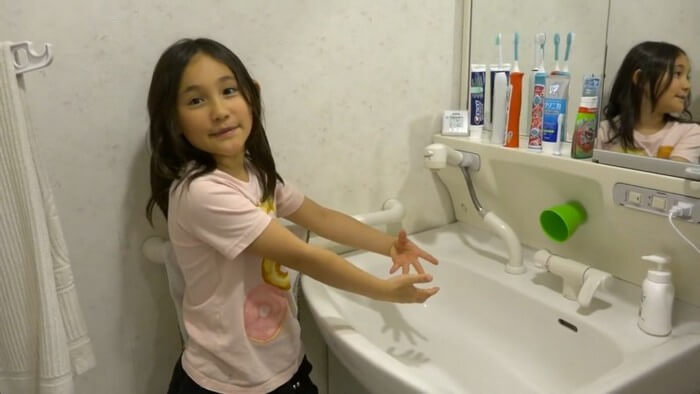
Find the location of `toothbrush`. toothbrush is located at coordinates (567, 49), (552, 41), (542, 41), (518, 50), (498, 50).